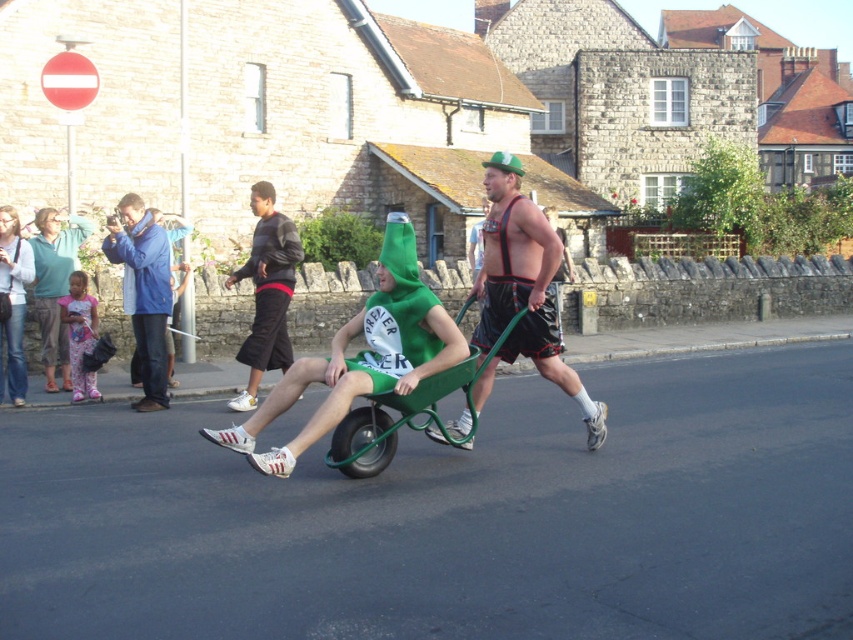
Question: Among these points, which one is farthest from the camera?

Choices:
 (A) (148, 285)
 (B) (242, 266)
 (C) (405, 396)
 (D) (514, 250)

Answer: (B)

Question: Does green plastic wheelbarrow at center appear on the left side of blue fabric jacket at left?

Choices:
 (A) no
 (B) yes

Answer: (A)

Question: Which object is positioned closest to the green plastic wheelbarrow at center?

Choices:
 (A) blue fabric jacket at left
 (B) shiny metallic shorts at center

Answer: (B)

Question: Is shiny metallic shorts at center positioned behind blue fabric jacket at left?

Choices:
 (A) no
 (B) yes

Answer: (A)

Question: Can you confirm if green plastic wheelbarrow at center is positioned above striped sweater at center?

Choices:
 (A) yes
 (B) no

Answer: (B)

Question: Among these points, which one is nearest to the camera?

Choices:
 (A) (x=428, y=422)
 (B) (x=289, y=362)

Answer: (A)